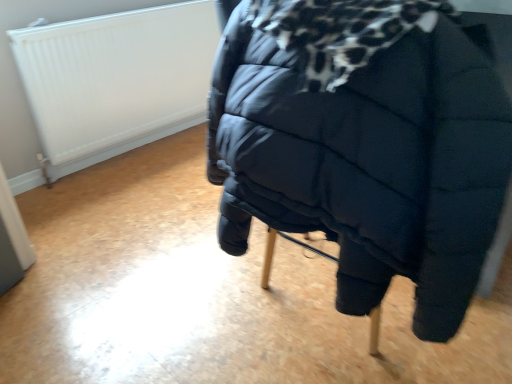
The image size is (512, 384). Find the location of `free location above white textured radiator at upper left (from a real-world perspective)`. free location above white textured radiator at upper left (from a real-world perspective) is located at coordinates (113, 12).